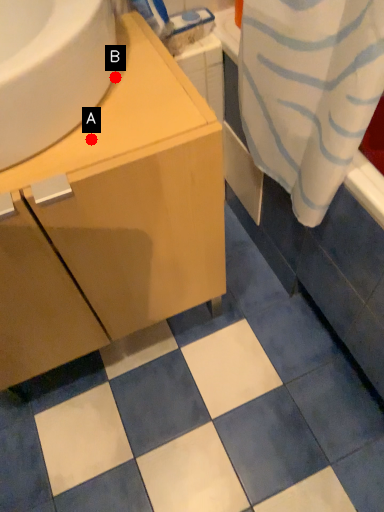
Question: Two points are circled on the image, labeled by A and B beside each circle. Which point is closer to the camera taking this photo?

Choices:
 (A) A is closer
 (B) B is closer

Answer: (A)